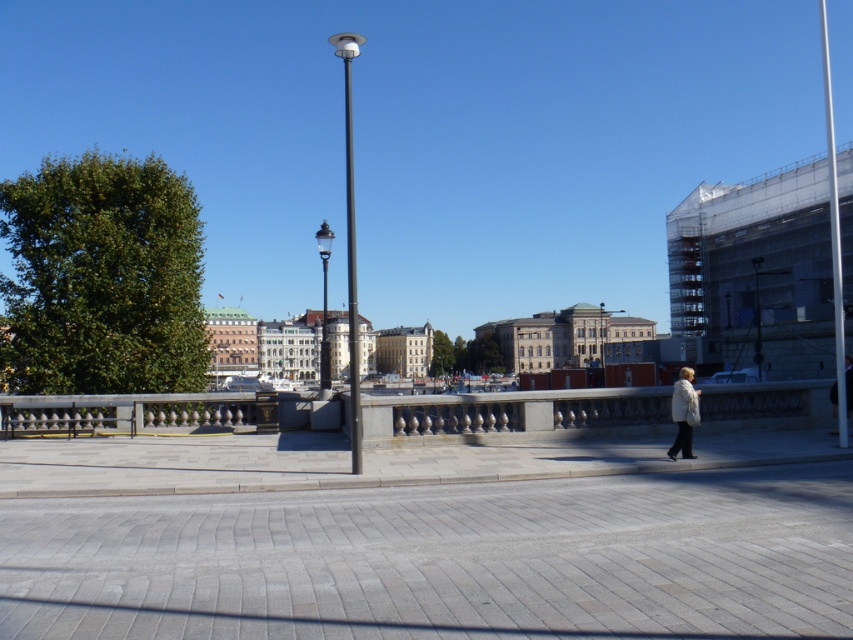
Question: Does gray brick pavement at center appear under black metal lamp post at center?

Choices:
 (A) yes
 (B) no

Answer: (A)

Question: Does white metallic pole at right appear under polished metal pole at center?

Choices:
 (A) yes
 (B) no

Answer: (B)

Question: Considering the real-world distances, which object is closest to the polished metal pole at center?

Choices:
 (A) black polished metal streetlight at center
 (B) white metallic pole at right
 (C) gray brick pavement at center

Answer: (A)

Question: Based on their relative distances, which object is farther from the black metal lamp post at center?

Choices:
 (A) white fuzzy coat at lower right
 (B) gray brick pavement at center

Answer: (A)

Question: Which point appears closest to the camera in this image?

Choices:
 (A) (683, 394)
 (B) (351, 333)

Answer: (B)

Question: Does black polished metal streetlight at center have a greater width compared to polished metal pole at center?

Choices:
 (A) yes
 (B) no

Answer: (A)